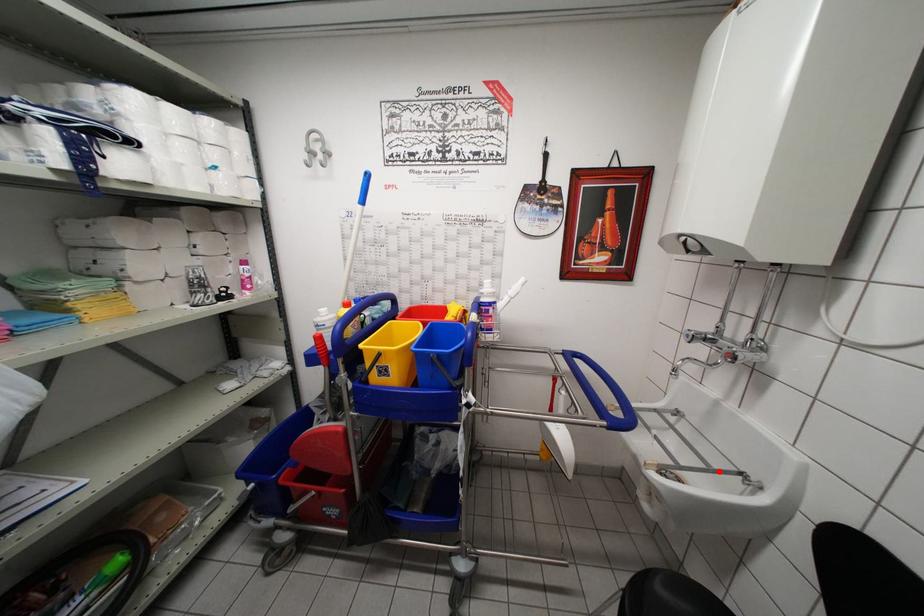
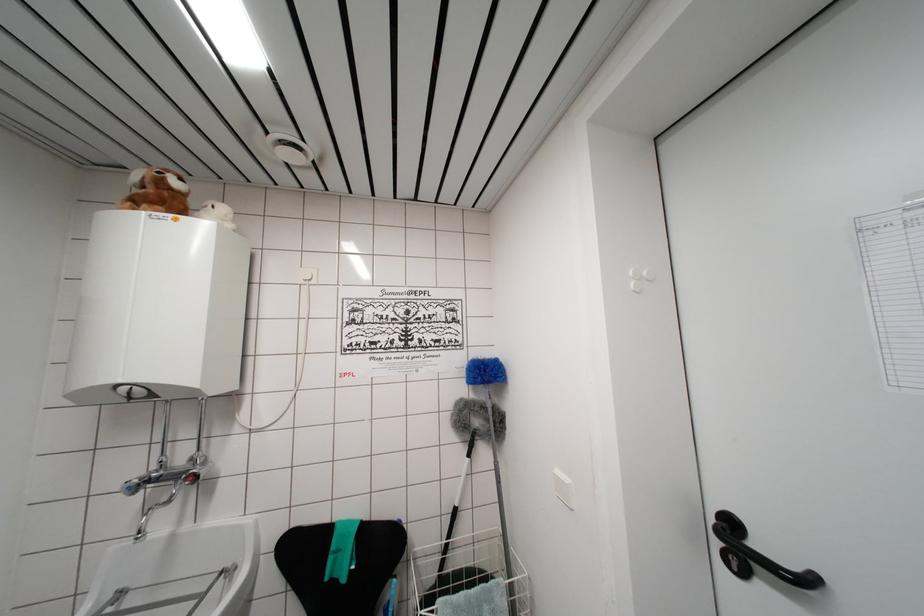
Where in the second image is the point corresponding to the highlighted location from the first image?

(209, 593)